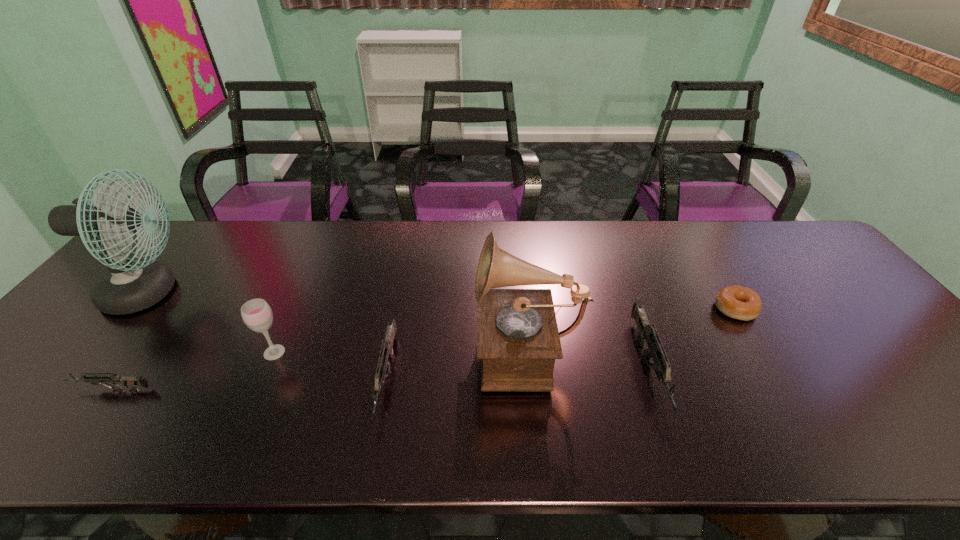
At what (x,y) coordinates should I click in order to perform the action: click on free location located 0.160m on the right of the bagel. Please return your answer as a coordinate pair (x, y). Looking at the image, I should click on (815, 309).

You are a GUI agent. You are given a task and a screenshot of the screen. Output one action in this format:
    pyautogui.click(x=<x>, y=<y>)
    Task: Click on the vacant space situated 0.140m on the right of the wineglass
    The height and width of the screenshot is (540, 960).
    Given the screenshot: What is the action you would take?
    pyautogui.click(x=345, y=352)

The width and height of the screenshot is (960, 540). Identify the location of vacant space located 0.390m on the horn of the fifth object from left to right. (317, 347).

Where is `vacant space situated on the horn of the fifth object from left to right`? vacant space situated on the horn of the fifth object from left to right is located at coordinates (395, 347).

You are a GUI agent. You are given a task and a screenshot of the screen. Output one action in this format:
    pyautogui.click(x=<x>, y=<y>)
    Task: Click on the vacant region located 0.340m on the horn of the fifth object from left to right
    The width and height of the screenshot is (960, 540).
    Given the screenshot: What is the action you would take?
    pyautogui.click(x=337, y=347)

You are a GUI agent. You are given a task and a screenshot of the screen. Output one action in this format:
    pyautogui.click(x=<x>, y=<y>)
    Task: Click on the free space located 0.300m in front of the fan where the airflow is directed
    Image resolution: width=960 pixels, height=540 pixels.
    Given the screenshot: What is the action you would take?
    pyautogui.click(x=300, y=293)

The height and width of the screenshot is (540, 960). I want to click on object at the far edge, so click(x=129, y=286).

You are a GUI agent. You are given a task and a screenshot of the screen. Output one action in this format:
    pyautogui.click(x=<x>, y=<y>)
    Task: Click on the record player at the near edge
    The image size is (960, 540).
    Given the screenshot: What is the action you would take?
    pyautogui.click(x=518, y=340)

In order to click on gun that is at the left edge in this screenshot , I will do `click(129, 382)`.

The image size is (960, 540). What are the coordinates of `fan located at the left edge` in the screenshot? It's located at (129, 286).